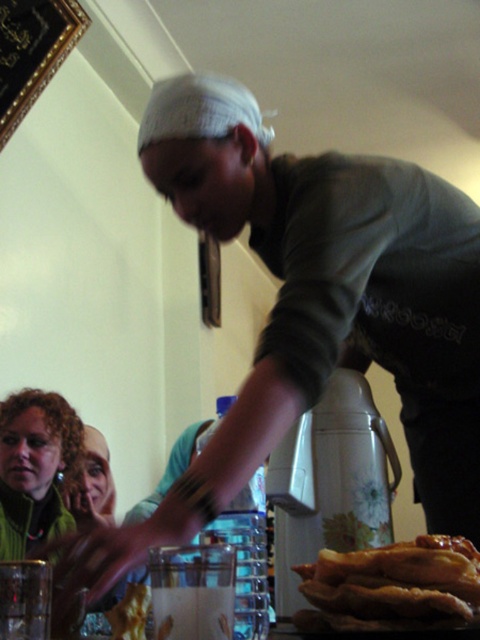
In the scene shown: You are standing in the dining area and need to place a small bowl on the table. The bowl is too hot to touch, so you decide to set it down near the white plastic blender at center. Where should you place it?

You should place the small bowl near the white plastic blender at center, which is located at point (330, 483) on the table.

You are at a kitchen counter and need to reach the golden crispy pastry at lower right. Is the white plastic blender at center blocking your path to it?

The golden crispy pastry at lower right is behind the white plastic blender at center, so the blender is blocking the direct path to the pastry.